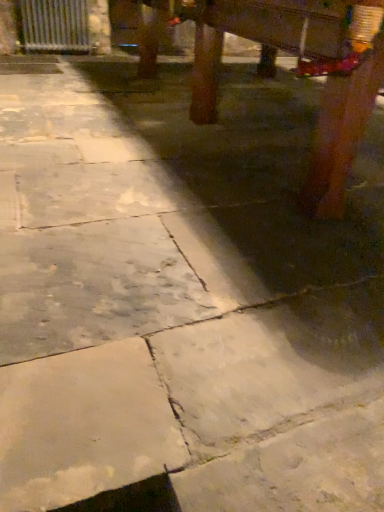
This screenshot has height=512, width=384. What are the coordinates of `wooden table at center` in the screenshot? It's located at (301, 72).

Describe the element at coordinates (301, 72) in the screenshot. Image resolution: width=384 pixels, height=512 pixels. I see `wooden table at center` at that location.

Locate an element on the screen. The height and width of the screenshot is (512, 384). wooden table at center is located at coordinates (301, 72).